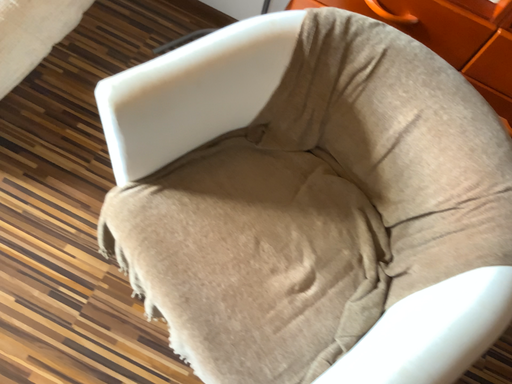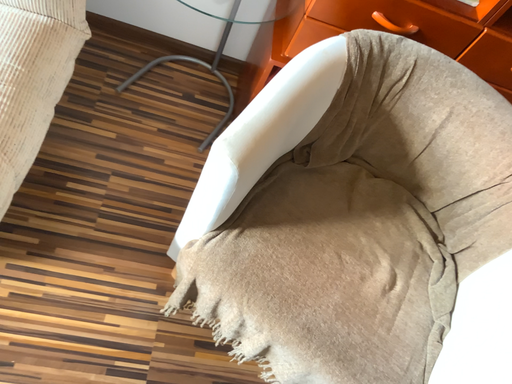
Question: Which way did the camera rotate in the video?

Choices:
 (A) rotated left
 (B) rotated right

Answer: (B)